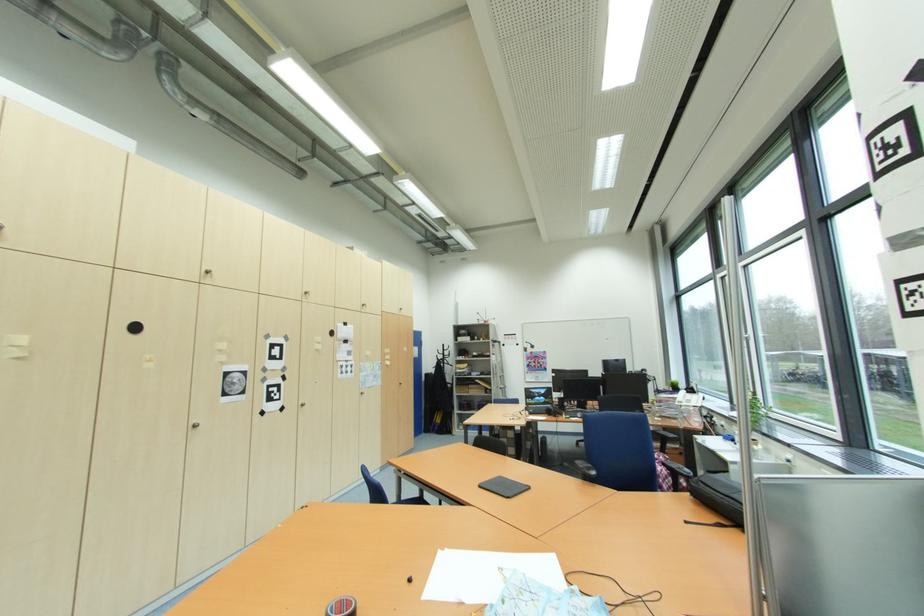
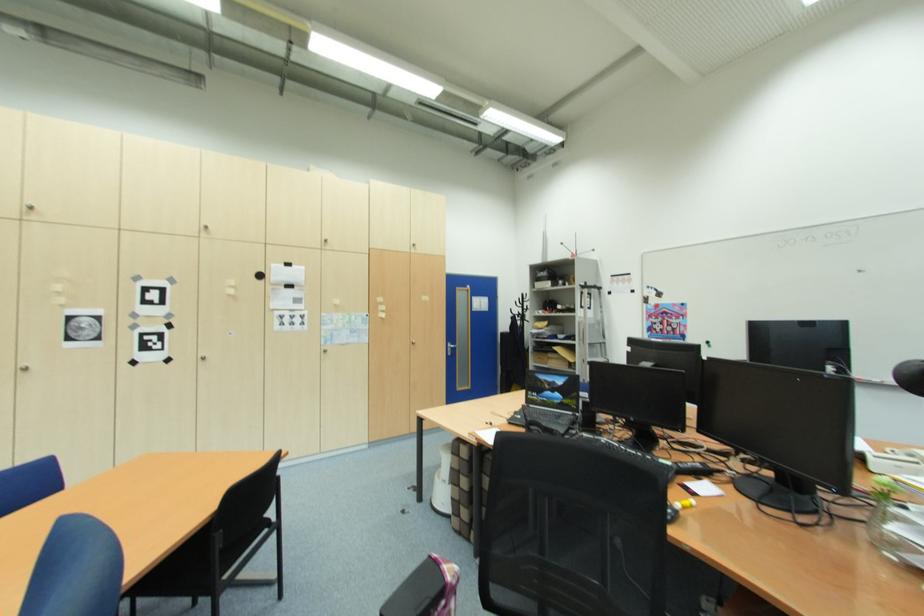
Find the pixel in the second image that matches (x=551, y=402) in the first image.

(569, 402)